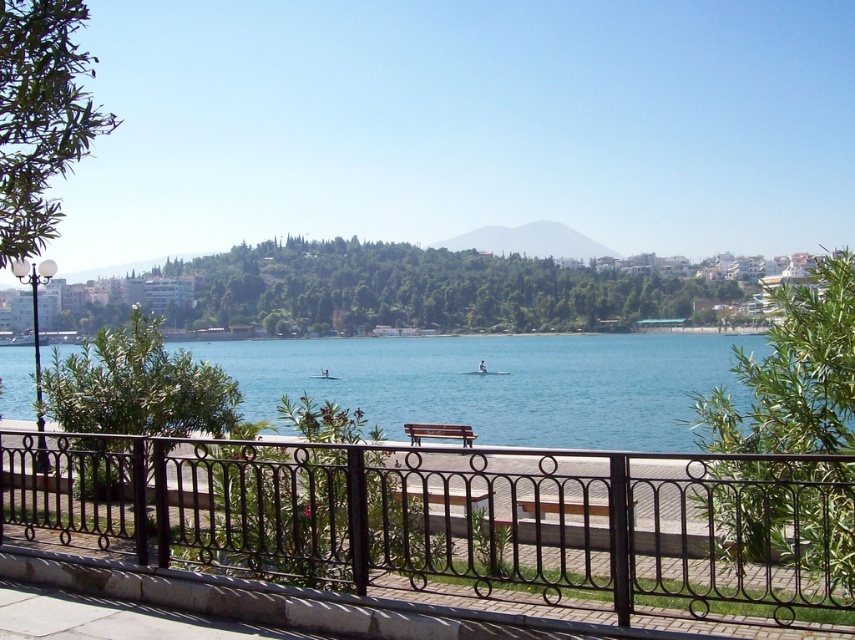
Can you confirm if black wrought iron fence at center is taller than wooden bench at center?

Indeed, black wrought iron fence at center has a greater height compared to wooden bench at center.

Who is more distant from viewer, (779, 556) or (416, 429)?

Positioned behind is point (416, 429).

Is point (761, 465) positioned behind point (470, 429)?

No, it is not.

Identify the location of black wrought iron fence at center. (455, 515).

At what (x,y) coordinates should I click in order to perform the action: click on black wrought iron fence at center. Please return your answer as a coordinate pair (x, y). This screenshot has width=855, height=640. Looking at the image, I should click on (455, 515).

Is point (457, 556) positioned in front of point (228, 364)?

Yes.

Between point (755, 548) and point (332, 339), which one is positioned in front?

Point (755, 548) is more forward.

You are a GUI agent. You are given a task and a screenshot of the screen. Output one action in this format:
    pyautogui.click(x=<x>, y=<y>)
    Task: Click on the black wrought iron fence at center
    
    Given the screenshot: What is the action you would take?
    pyautogui.click(x=455, y=515)

Who is more distant from viewer, (242,381) or (447,424)?

Point (242,381)

Who is more distant from viewer, (526, 355) or (469, 438)?

Positioned behind is point (526, 355).

At what (x,y) coordinates should I click in order to perform the action: click on blue water at center. Please return your answer as a coordinate pair (x, y). Looking at the image, I should click on click(x=499, y=384).